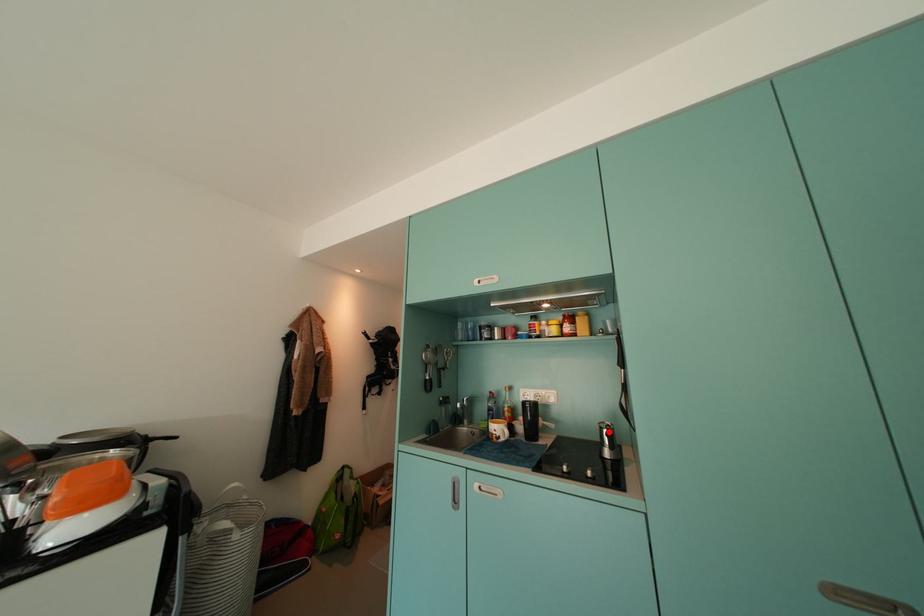
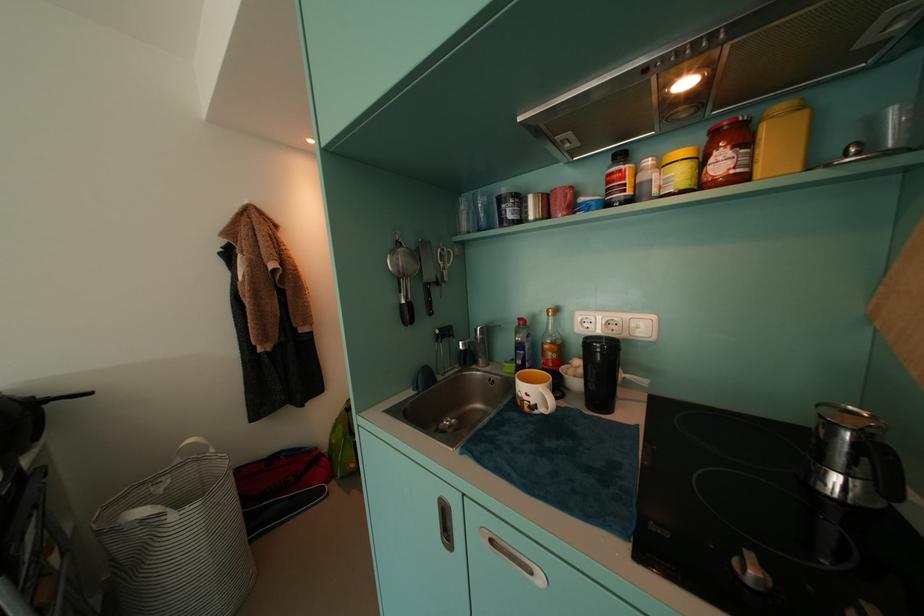
Find the pixel in the second image that matches the highlighted location in the first image.

(837, 429)